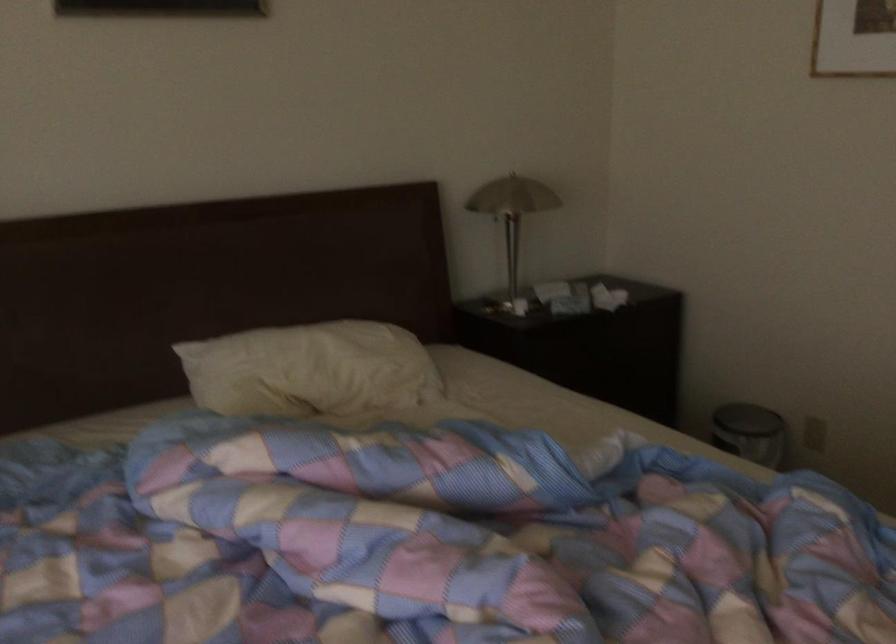
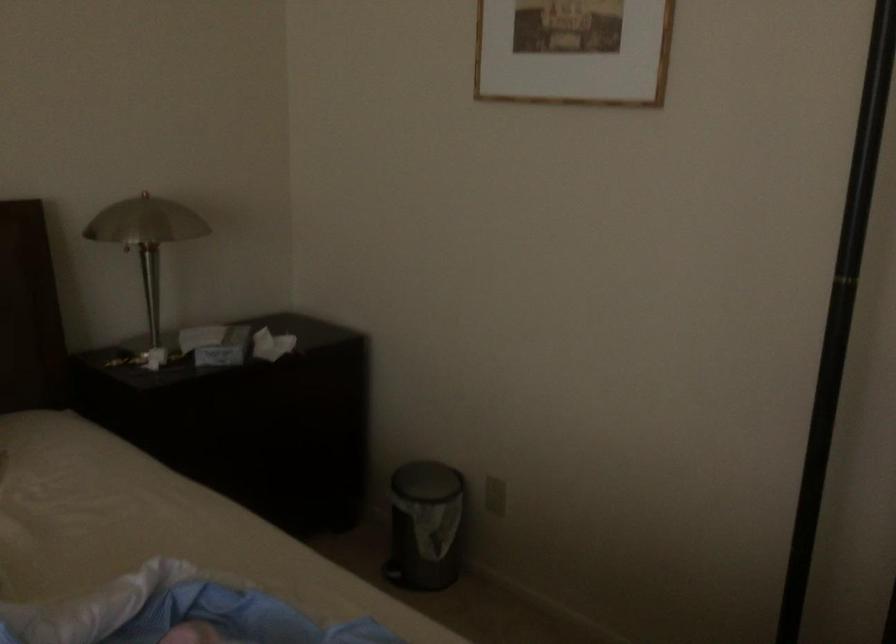
Question: How did the camera likely rotate?

Choices:
 (A) Left
 (B) Right
 (C) Up
 (D) Down

Answer: (B)